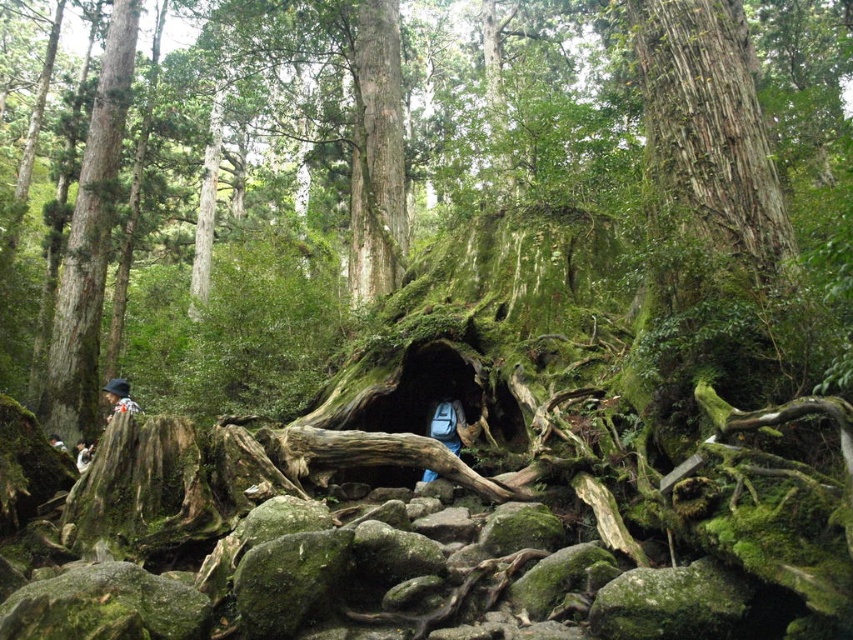
Question: Which object is the farthest from the green mossy bark tree trunk at center?

Choices:
 (A) camouflage jacket at left
 (B) smooth brown tree trunk at left
 (C) green mossy tree trunk at center
 (D) blue fabric backpack at center

Answer: (C)

Question: Is smooth brown tree trunk at left bigger than camouflage jacket at left?

Choices:
 (A) yes
 (B) no

Answer: (A)

Question: Which object appears farthest from the camera in this image?

Choices:
 (A) smooth brown tree trunk at left
 (B) blue fabric backpack at center
 (C) camouflage jacket at left

Answer: (A)

Question: Is green mossy bark tree trunk at center below blue fabric backpack at center?

Choices:
 (A) yes
 (B) no

Answer: (B)

Question: Among these points, which one is farthest from the camera?

Choices:
 (A) (366, 134)
 (B) (114, 404)
 (C) (61, 285)
 (D) (437, 406)

Answer: (A)

Question: From the image, what is the correct spatial relationship of smooth brown tree trunk at left in relation to green mossy bark tree trunk at center?

Choices:
 (A) left
 (B) right

Answer: (A)